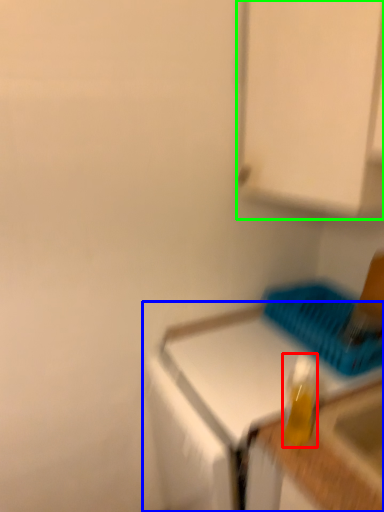
Question: Estimate the real-world distances between objects in this image. Which object is farther from bottle (highlighted by a red box), countertop (highlighted by a blue box) or cabinetry (highlighted by a green box)?

Choices:
 (A) countertop
 (B) cabinetry

Answer: (B)